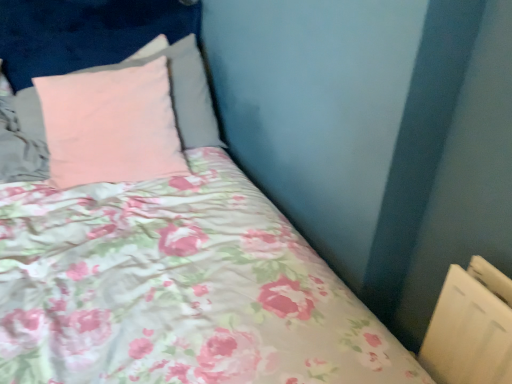
Image resolution: width=512 pixels, height=384 pixels. What do you see at coordinates (111, 126) in the screenshot?
I see `matte pink pillow at upper left` at bounding box center [111, 126].

Find the location of a particular element. matte pink pillow at upper left is located at coordinates (111, 126).

Locate an element on the screen. The width and height of the screenshot is (512, 384). matte pink pillow at upper left is located at coordinates (111, 126).